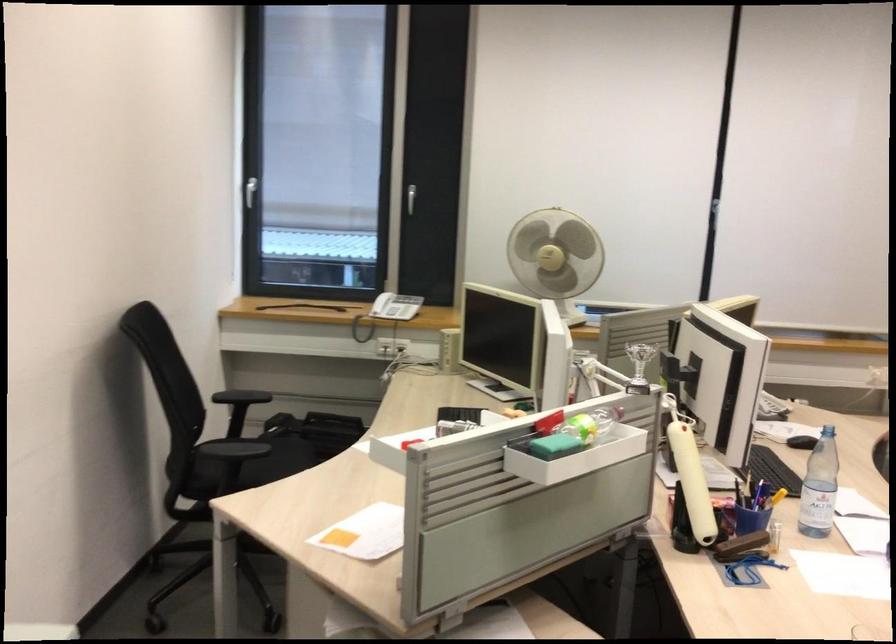
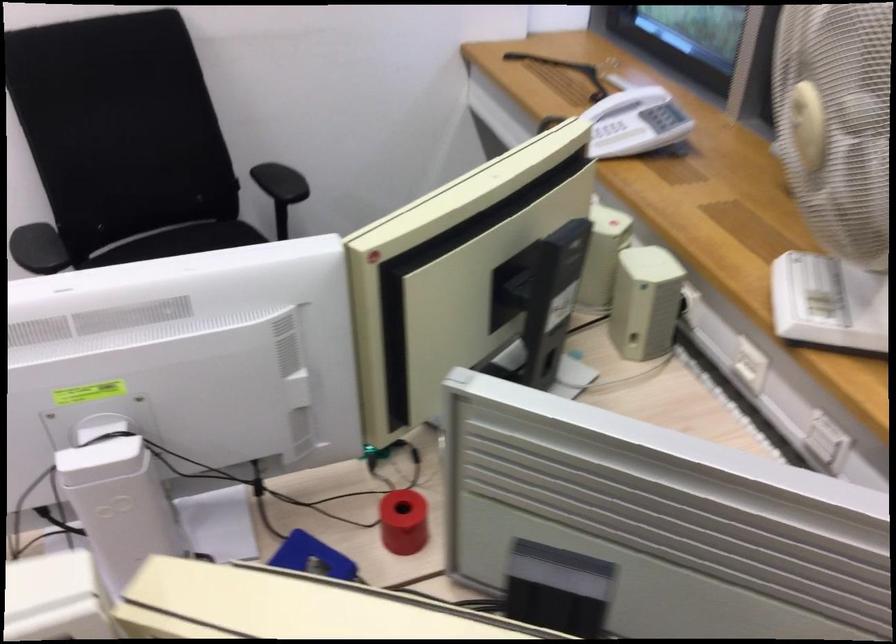
Question: I am providing you with two images of the same scene from different viewpoints. Please identify which objects are invisible in image2.

Choices:
 (A) telephone keypad
 (B) whiteboard keyboard
 (C) beige computer speaker
 (D) white desk fan

Answer: (D)